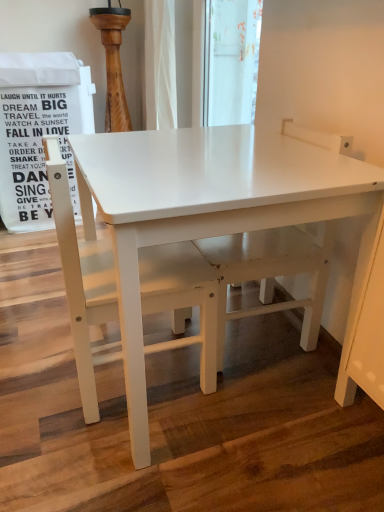
Question: Should I look upward or downward to see white matte table at center?

Choices:
 (A) up
 (B) down

Answer: (B)

Question: From a real-world perspective, is white matte table at center located beneath white matte chair at center?

Choices:
 (A) no
 (B) yes

Answer: (B)

Question: Does white matte table at center have a greater height compared to white matte chair at center?

Choices:
 (A) no
 (B) yes

Answer: (B)

Question: Is white matte chair at center a part of white matte table at center?

Choices:
 (A) yes
 (B) no

Answer: (A)

Question: From the image's perspective, would you say white matte table at center is shown under white matte chair at center?

Choices:
 (A) yes
 (B) no

Answer: (B)

Question: From the image's perspective, is white matte table at center on top of white matte chair at center?

Choices:
 (A) yes
 (B) no

Answer: (A)

Question: Does white matte table at center lie behind white matte chair at center?

Choices:
 (A) no
 (B) yes

Answer: (A)

Question: Is white matte chair at center oriented away from white matte table at center?

Choices:
 (A) no
 (B) yes

Answer: (B)

Question: Can you confirm if white matte chair at center is positioned to the right of white matte table at center?

Choices:
 (A) yes
 (B) no

Answer: (B)

Question: Is the surface of white matte chair at center in direct contact with white matte table at center?

Choices:
 (A) yes
 (B) no

Answer: (B)

Question: Does white matte chair at center lie in front of white matte table at center?

Choices:
 (A) no
 (B) yes

Answer: (A)

Question: Is white matte chair at center far away from white matte table at center?

Choices:
 (A) no
 (B) yes

Answer: (A)

Question: Is white matte chair at center smaller than white matte table at center?

Choices:
 (A) no
 (B) yes

Answer: (B)

Question: In terms of size, does white matte table at center appear bigger or smaller than white matte chair at center?

Choices:
 (A) big
 (B) small

Answer: (A)